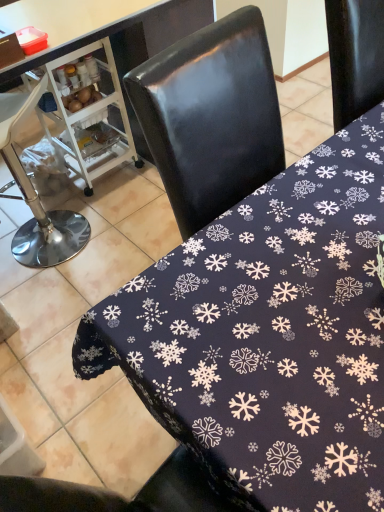
Question: From the image's perspective, is black fabric tablecloth at center, the first table positioned from the left, under dark blue fabric with snowflake pattern at center, the 1th table positioned from the right?

Choices:
 (A) no
 (B) yes

Answer: (A)

Question: From a real-world perspective, is black fabric tablecloth at center, the second table in the right-to-left sequence, located beneath dark blue fabric with snowflake pattern at center, the 1th table positioned from the right?

Choices:
 (A) yes
 (B) no

Answer: (B)

Question: Is black fabric tablecloth at center, the second table in the right-to-left sequence, taller than dark blue fabric with snowflake pattern at center, which is the 2th table from left to right?

Choices:
 (A) no
 (B) yes

Answer: (B)

Question: Is dark blue fabric with snowflake pattern at center, the 1th table positioned from the right, inside black fabric tablecloth at center, the second table in the right-to-left sequence?

Choices:
 (A) no
 (B) yes

Answer: (A)

Question: From a real-world perspective, is black fabric tablecloth at center, the second table in the right-to-left sequence, positioned over dark blue fabric with snowflake pattern at center, which is the 2th table from left to right, based on gravity?

Choices:
 (A) no
 (B) yes

Answer: (B)

Question: Do you think brushed metal bar stool at left is within dark blue fabric with snowflake pattern at center, the 1th table positioned from the right, or outside of it?

Choices:
 (A) inside
 (B) outside

Answer: (B)

Question: From a real-world perspective, is brushed metal bar stool at left positioned above or below dark blue fabric with snowflake pattern at center, the 1th table positioned from the right?

Choices:
 (A) below
 (B) above

Answer: (A)

Question: In the image, is brushed metal bar stool at left positioned in front of or behind dark blue fabric with snowflake pattern at center, which is the 2th table from left to right?

Choices:
 (A) behind
 (B) front

Answer: (A)

Question: Considering the positions of point (61, 209) and point (375, 422), is point (61, 209) closer or farther from the camera than point (375, 422)?

Choices:
 (A) closer
 (B) farther

Answer: (B)

Question: Looking at their shapes, would you say black fabric tablecloth at center, the first table positioned from the left, is wider or thinner than dark blue fabric with snowflake pattern at center, which is the 2th table from left to right?

Choices:
 (A) wide
 (B) thin

Answer: (B)

Question: Do you think black fabric tablecloth at center, the first table positioned from the left, is within dark blue fabric with snowflake pattern at center, the 1th table positioned from the right, or outside of it?

Choices:
 (A) outside
 (B) inside

Answer: (A)

Question: Is black fabric tablecloth at center, the second table in the right-to-left sequence, taller or shorter than dark blue fabric with snowflake pattern at center, the 1th table positioned from the right?

Choices:
 (A) short
 (B) tall

Answer: (B)

Question: Considering the positions of point (157, 41) and point (226, 487), is point (157, 41) closer or farther from the camera than point (226, 487)?

Choices:
 (A) farther
 (B) closer

Answer: (A)

Question: Looking at their shapes, would you say dark blue fabric with snowflake pattern at center, which is the 2th table from left to right, is wider or thinner than white plastic cart at left?

Choices:
 (A) wide
 (B) thin

Answer: (A)

Question: From the image's perspective, is dark blue fabric with snowflake pattern at center, which is the 2th table from left to right, positioned above or below white plastic cart at left?

Choices:
 (A) below
 (B) above

Answer: (A)